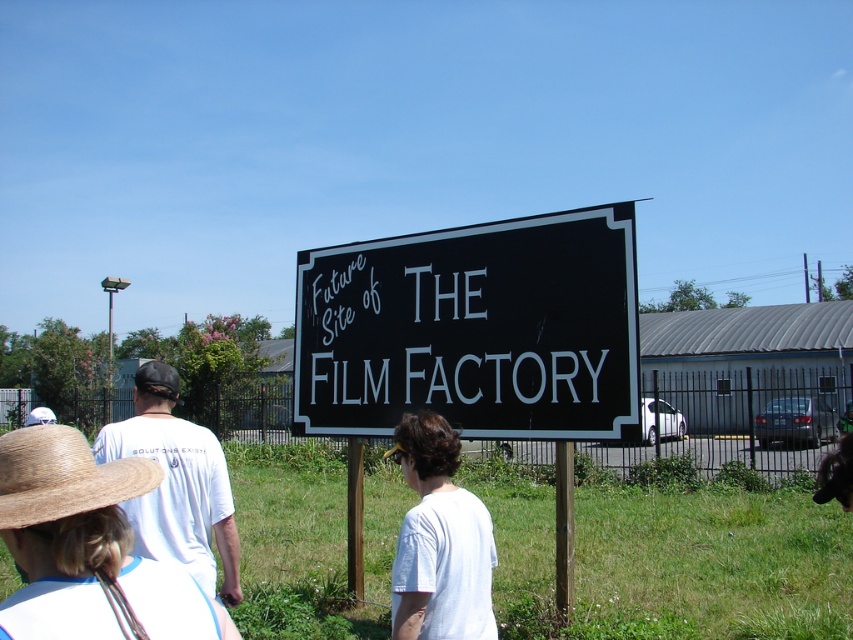
You are standing at the sign and want to take a photo of the fenced area in the background. Which point, point (437, 564) or point (158, 390), is closer to the camera to ensure the fenced area is in focus?

Point (437, 564) is closer to the camera than point (158, 390), so focusing on point (437, 564) will ensure the fenced area is in focus.

You are a photographer standing at the center of the scene. You want to take a photo of the black painted signboard at center and the brown straw hat at lower left. Can you fit both objects in the frame of your camera which has a maximum field of view of 3 meters between the closest and farthest objects?

The black painted signboard at center and brown straw hat at lower left are 2.97 meters apart. Since the distance between them is less than the camera field of view of 3 meters, both objects can be captured in the frame.

You are a photographer standing at the edge of the grassy area. You want to take a photo of the black painted signboard at center without the brown straw hat at lower left appearing in the frame. Is it possible to adjust your position to achieve this?

The brown straw hat at lower left is behind the black painted signboard at center, so you can position yourself so that the signboard blocks the view of the hat, making it possible to take a photo of the black painted signboard at center without the brown straw hat at lower left in the frame.